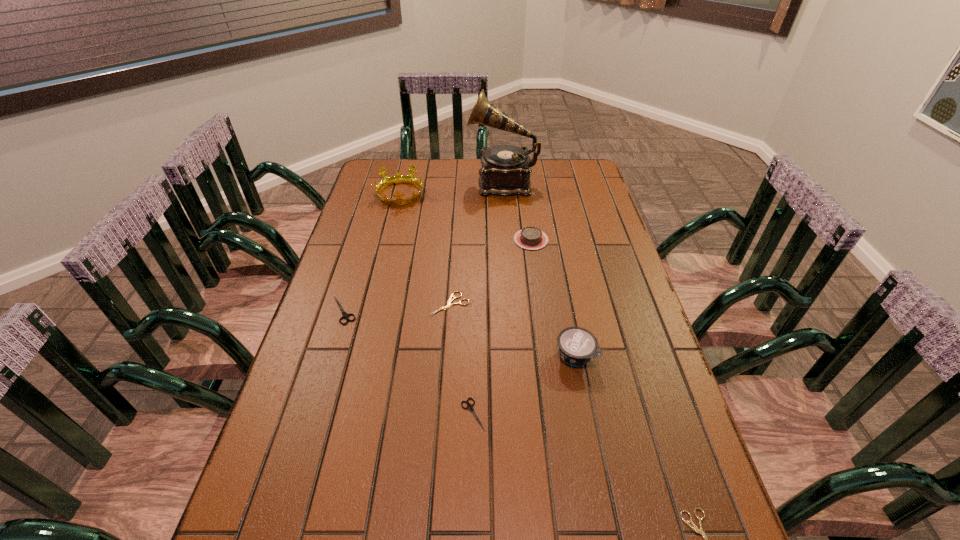
Where is `phonograph record`? The image size is (960, 540). phonograph record is located at coordinates (505, 171).

Image resolution: width=960 pixels, height=540 pixels. What are the coordinates of `gold crown` in the screenshot? It's located at (398, 178).

Identify the location of crown. The width and height of the screenshot is (960, 540). (398, 178).

The image size is (960, 540). Identify the location of the sixth shortest object. (577, 345).

You are a GUI agent. You are given a task and a screenshot of the screen. Output one action in this format:
    pyautogui.click(x=<x>, y=<y>)
    Task: Click on the yogurt
    
    Given the screenshot: What is the action you would take?
    pyautogui.click(x=577, y=345)

You are a GUI agent. You are given a task and a screenshot of the screen. Output one action in this format:
    pyautogui.click(x=<x>, y=<y>)
    Task: Click on the chocolate cake
    This screenshot has width=960, height=540.
    Given the screenshot: What is the action you would take?
    pyautogui.click(x=531, y=238)

Image resolution: width=960 pixels, height=540 pixels. Identify the location of the sixth nearest object. (531, 238).

Where is `the left black shears`? the left black shears is located at coordinates (345, 315).

Find the location of a particular element. The height and width of the screenshot is (540, 960). the bigger black shears is located at coordinates (345, 315).

The width and height of the screenshot is (960, 540). What are the coordinates of `the farther beige shears` in the screenshot? It's located at (450, 300).